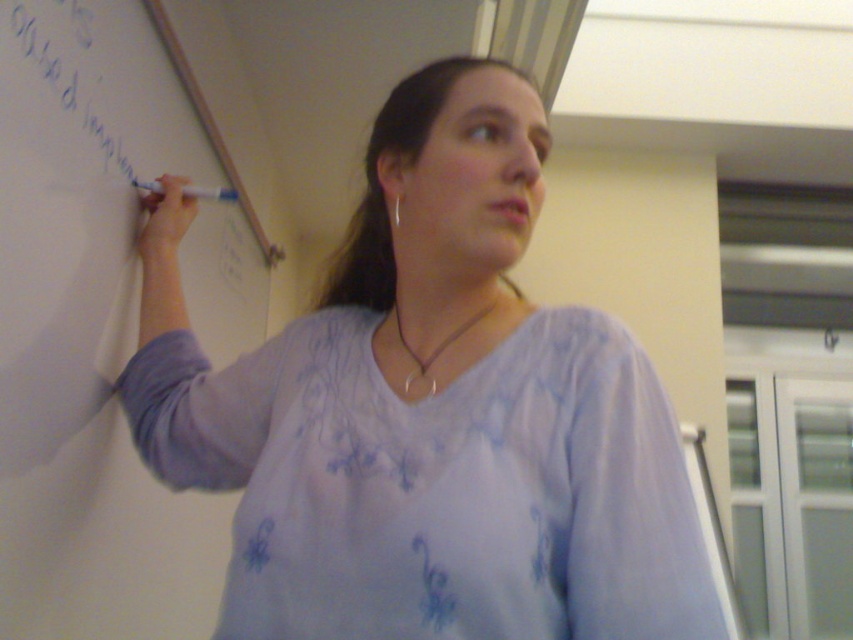
You are a painter holding a 24 inch wide canvas. You want to place it on the light purple fabric at upper left. Can the canvas fit on the fabric?

The light purple fabric at upper left is 27.36 inches away from the viewer, so the 24 inch wide canvas can fit on the fabric since its width is less than the distance available.

You are trying to determine the distance between two points in the image. The points are located at coordinates point (83, 128) and point (57, 74). Based on their positions, which point is closer to you?

Point (57, 74) is closer to you because it is less further to the viewer than point (83, 128).

You are a student trying to take notes on the whiteboard at left and the white marker at upper left. Which object is closer to you?

The whiteboard at left is closer to you than the white marker at upper left because it is further to the viewer.